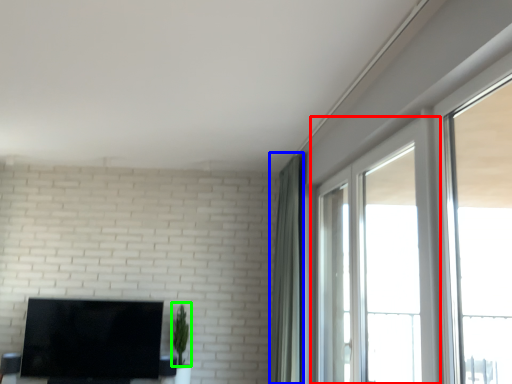
Question: Based on their relative distances, which object is farther from window (highlighted by a red box)? Choose from curtain (highlighted by a blue box) and plant (highlighted by a green box).

Choices:
 (A) curtain
 (B) plant

Answer: (B)